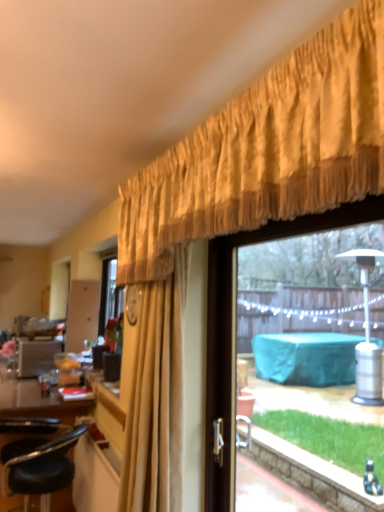
Question: Looking at their shapes, would you say black leather stool at lower left is wider or thinner than gold textured curtain at upper center?

Choices:
 (A) wide
 (B) thin

Answer: (A)

Question: Based on their positions, is black leather stool at lower left located to the left or right of gold textured curtain at upper center?

Choices:
 (A) right
 (B) left

Answer: (B)

Question: Based on their relative distances, which object is nearer to the gold textured curtain at upper center?

Choices:
 (A) black leather stool at lower left
 (B) transparent glass window at upper right

Answer: (B)

Question: Considering the real-world distances, which object is farthest from the gold textured curtain at upper center?

Choices:
 (A) transparent glass window at upper right
 (B) black leather stool at lower left

Answer: (B)